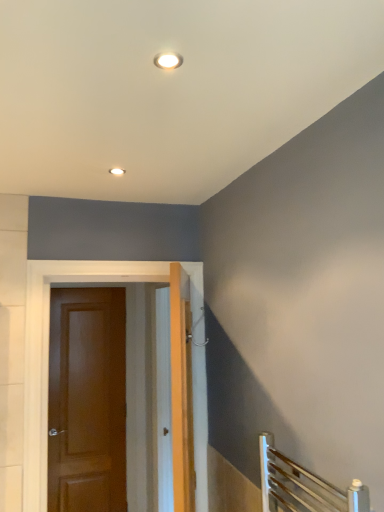
Question: Is matte brown door at left, the second door viewed from the front, inside the boundaries of matte white recessed light at upper center, or outside?

Choices:
 (A) outside
 (B) inside

Answer: (A)

Question: Is point (104, 449) closer or farther from the camera than point (122, 174)?

Choices:
 (A) farther
 (B) closer

Answer: (A)

Question: Which object is positioned closest to the brown wooden door at center, which appears as the first door when viewed from the front?

Choices:
 (A) matte white recessed light at upper center
 (B) matte brown door at left, positioned as the second door in right-to-left order

Answer: (A)

Question: Which object is positioned closest to the brown wooden door at center, the 2th door viewed from the back?

Choices:
 (A) matte white recessed light at upper center
 (B) matte brown door at left, positioned as the first door in back-to-front order

Answer: (A)